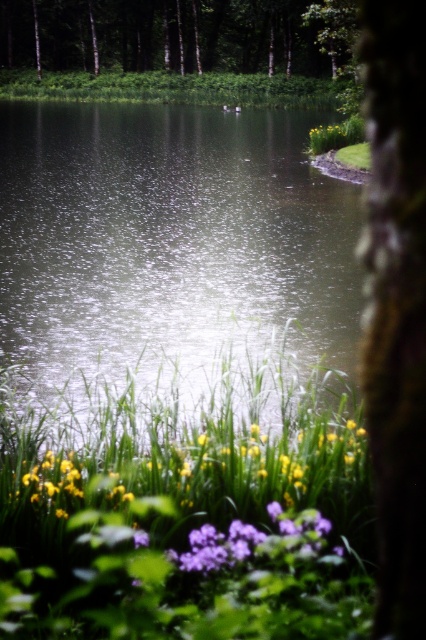
Question: Which point is farther from the camera taking this photo?

Choices:
 (A) (420, 163)
 (B) (351, 150)
 (C) (333, 65)
 (D) (347, 33)

Answer: (C)

Question: Can you confirm if smooth bark tree at upper center is smaller than green matte tree at upper center?

Choices:
 (A) yes
 (B) no

Answer: (B)

Question: In this image, where is glistening water at center located relative to green grass at upper right?

Choices:
 (A) above
 (B) below

Answer: (A)

Question: Which object appears closest to the camera in this image?

Choices:
 (A) smooth bark tree trunk at right
 (B) green matte tree at upper center
 (C) yellow matte flower at upper right
 (D) smooth bark tree at upper center

Answer: (A)

Question: Can you confirm if glistening water at center is thinner than green grass at upper right?

Choices:
 (A) no
 (B) yes

Answer: (A)

Question: Which of the following is the closest to the observer?

Choices:
 (A) smooth bark tree at upper center
 (B) green matte tree at upper center
 (C) smooth bark tree trunk at right

Answer: (C)